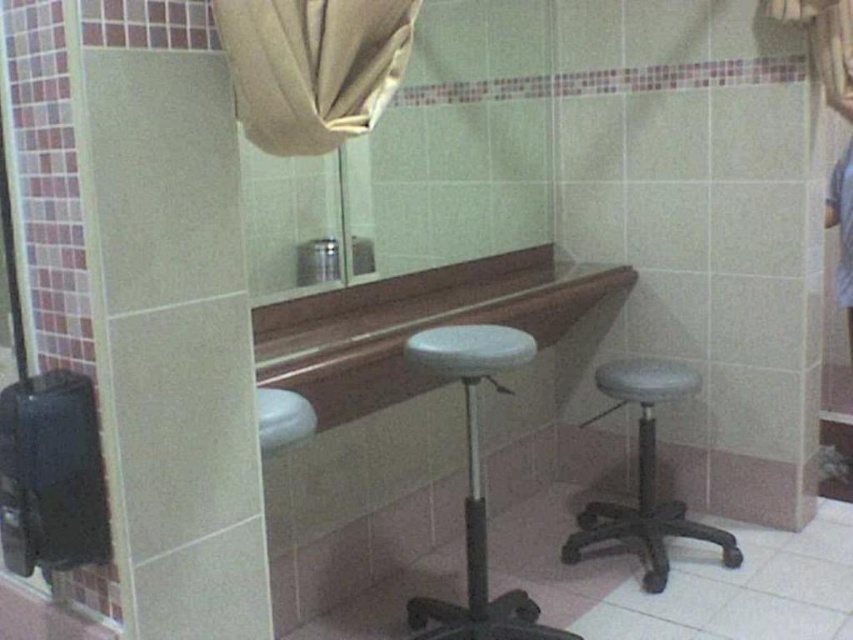
Between gray matte bar stool at center and white glossy sink at center, which one is positioned higher?

Positioned higher is white glossy sink at center.

Can you confirm if gray matte bar stool at center is bigger than white glossy sink at center?

Correct, gray matte bar stool at center is larger in size than white glossy sink at center.

I want to click on gray matte bar stool at center, so click(643, 474).

Identify the location of gray matte bar stool at center. This screenshot has width=853, height=640. (643, 474).

Who is higher up, white matte bar stool at center or gray matte bar stool at center?

white matte bar stool at center

Which of these two, white matte bar stool at center or gray matte bar stool at center, stands taller?

With more height is white matte bar stool at center.

Does point (491, 368) lie in front of point (643, 387)?

Yes, point (491, 368) is in front of point (643, 387).

Locate an element on the screen. This screenshot has height=640, width=853. white matte bar stool at center is located at coordinates (474, 490).

Does point (244, 90) come in front of point (427, 349)?

Yes, it is.

From the picture: Does beige fabric curtain at upper center have a larger size compared to white matte bar stool at center?

No.

Where is `beige fabric curtain at upper center`? Image resolution: width=853 pixels, height=640 pixels. beige fabric curtain at upper center is located at coordinates (312, 67).